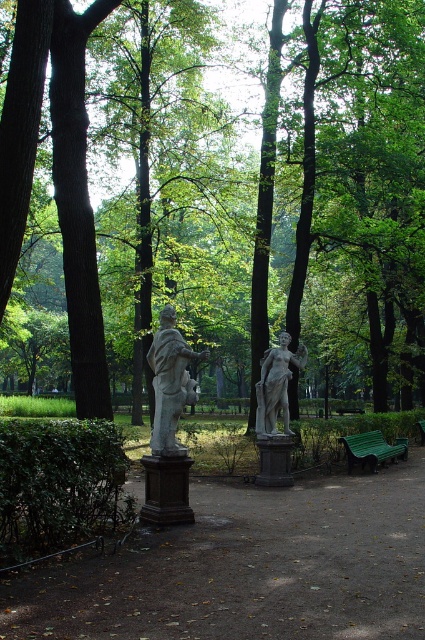
Question: Can you confirm if gray stone statue at center is wider than white marble statue at center?

Choices:
 (A) no
 (B) yes

Answer: (A)

Question: Which point is closer to the camera?

Choices:
 (A) tap(244, 188)
 (B) tap(167, 310)

Answer: (B)

Question: Is white marble statue at center behind green painted wood bench at lower right?

Choices:
 (A) yes
 (B) no

Answer: (B)

Question: Which point is closer to the camera?

Choices:
 (A) white marble statue at center
 (B) gray stone statue at center

Answer: (B)

Question: Based on their relative distances, which object is nearer to the gray stone statue at center?

Choices:
 (A) white marble statue at center
 (B) brown wood tree at center
 (C) green painted wood bench at lower right

Answer: (A)

Question: Can you confirm if gray stone statue at center is smaller than green painted wood bench at lower right?

Choices:
 (A) no
 (B) yes

Answer: (B)